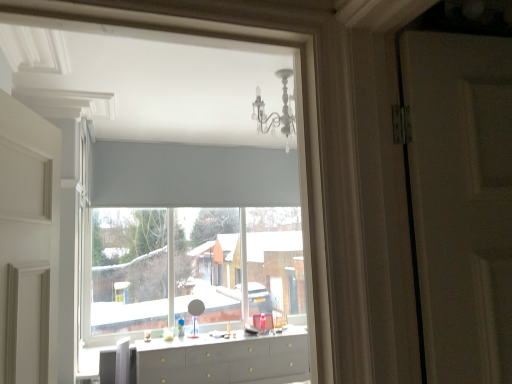
Image resolution: width=512 pixels, height=384 pixels. Describe the element at coordinates (225, 360) in the screenshot. I see `matte gray dresser at center` at that location.

I want to click on white matte window at center, so click(x=162, y=247).

Measure the distance between point (152, 154) and camera.

The distance of point (152, 154) from camera is 4.39 meters.

This screenshot has height=384, width=512. Identify the location of matte gray dresser at center. (225, 360).

How many degrees apart are the facing directions of white glossy counter top at center and matte gray dresser at center?

white glossy counter top at center and matte gray dresser at center are facing 0.216 degrees away from each other.

Which of these two, white glossy counter top at center or matte gray dresser at center, is thinner?

With smaller width is white glossy counter top at center.

Between point (165, 342) and point (170, 342), which one is positioned in front?

Point (165, 342)

Is white glossy counter top at center not close to matte gray dresser at center?

white glossy counter top at center is near matte gray dresser at center, not far away.

Who is bigger, matte gray dresser at center or white plastic swivel chair at lower left?

With larger size is matte gray dresser at center.

How distant is matte gray dresser at center from white plastic swivel chair at lower left?

matte gray dresser at center and white plastic swivel chair at lower left are 25.60 inches apart.

How many degrees apart are the facing directions of matte gray dresser at center and white plastic swivel chair at lower left?

There is a 0.742-degree angle between the facing directions of matte gray dresser at center and white plastic swivel chair at lower left.

Which object is positioned more to the right, matte gray dresser at center or white plastic swivel chair at lower left?

matte gray dresser at center is more to the right.

Is white plastic swivel chair at lower left far from matte gray dresser at center?

They are positioned close to each other.

Between white plastic swivel chair at lower left and matte gray dresser at center, which one appears on the left side from the viewer's perspective?

From the viewer's perspective, white plastic swivel chair at lower left appears more on the left side.

Can you tell me how much white plastic swivel chair at lower left and matte gray dresser at center differ in facing direction?

The facing directions of white plastic swivel chair at lower left and matte gray dresser at center are 0.742 degrees apart.

Where is `chest of drawers on the right of white plastic swivel chair at lower left`? chest of drawers on the right of white plastic swivel chair at lower left is located at coordinates (225, 360).

Which of these two, white plastic swivel chair at lower left or white matte window at center, is smaller?

white plastic swivel chair at lower left.

Which object is more forward, white plastic swivel chair at lower left or white matte window at center?

white plastic swivel chair at lower left.

Is white plastic swivel chair at lower left taller or shorter than white matte window at center?

In the image, white plastic swivel chair at lower left appears to be shorter than white matte window at center.

Does point (119, 366) appear closer or farther from the camera than point (197, 281)?

Clearly, point (119, 366) is closer to the camera than point (197, 281).

Can you tell me how much white plastic swivel chair at lower left and white glossy counter top at center differ in facing direction?

0.958 degrees.

Can you confirm if white plastic swivel chair at lower left is positioned to the left of white glossy counter top at center?

Correct, you'll find white plastic swivel chair at lower left to the left of white glossy counter top at center.

Is point (109, 357) more distant than point (257, 338)?

No, it is in front of (257, 338).

From the image's perspective, between white plastic swivel chair at lower left and white glossy counter top at center, which one is located above?

white glossy counter top at center appears higher in the image.

From the image's perspective, does white matte window at center appear lower than matte gray dresser at center?

No, from the image's perspective, white matte window at center is not below matte gray dresser at center.

Is white matte window at center to the left of matte gray dresser at center from the viewer's perspective?

Yes.

Consider the image. Is white matte window at center not inside matte gray dresser at center?

Yes, white matte window at center is outside of matte gray dresser at center.

From a real-world perspective, which object stands above the other?

white matte window at center, from a real-world perspective.

Does white matte window at center have a lesser width compared to white plastic swivel chair at lower left?

Indeed, white matte window at center has a lesser width compared to white plastic swivel chair at lower left.

Is white matte window at center further to the viewer compared to white plastic swivel chair at lower left?

Yes, white matte window at center is further from the viewer.

Considering the points (201, 326) and (119, 353), which point is in front, point (201, 326) or point (119, 353)?

The point (119, 353) is closer to the camera.

How much distance is there between white matte window at center and white plastic swivel chair at lower left?

white matte window at center and white plastic swivel chair at lower left are 2.29 meters apart.

You are a GUI agent. You are given a task and a screenshot of the screen. Output one action in this format:
    pyautogui.click(x=<x>, y=<y>)
    Task: Click on the chest of drawers in front of the white glossy counter top at center
    The image size is (512, 384).
    Given the screenshot: What is the action you would take?
    pyautogui.click(x=225, y=360)

Identify the location of swivel chair lying on the left of matte gray dresser at center. The image size is (512, 384). (118, 364).

From the image, which object appears to be farther from white glossy counter top at center, matte gray dresser at center or white plastic swivel chair at lower left?

white plastic swivel chair at lower left.

Based on their spatial positions, is matte gray dresser at center or white matte window at center closer to white plastic swivel chair at lower left?

A: matte gray dresser at center is positioned closer to the anchor white plastic swivel chair at lower left.

From the image, which object appears to be farther from white plastic swivel chair at lower left, white matte window at center or white glossy counter top at center?

white matte window at center lies further to white plastic swivel chair at lower left than the other object.

Based on their spatial positions, is white plastic swivel chair at lower left or white matte window at center closer to matte gray dresser at center?

white plastic swivel chair at lower left is closer to matte gray dresser at center.

Which object lies nearer to the anchor point white glossy counter top at center, white plastic swivel chair at lower left or white matte window at center?

white plastic swivel chair at lower left is positioned closer to the anchor white glossy counter top at center.

Estimate the real-world distances between objects in this image. Which object is further from white matte window at center, matte gray dresser at center or white plastic swivel chair at lower left?

white plastic swivel chair at lower left lies further to white matte window at center than the other object.

Estimate the real-world distances between objects in this image. Which object is further from white matte window at center, white plastic swivel chair at lower left or matte gray dresser at center?

white plastic swivel chair at lower left lies further to white matte window at center than the other object.

Considering their positions, is white glossy counter top at center positioned closer to white matte window at center than white plastic swivel chair at lower left?

white glossy counter top at center is closer to white matte window at center.

The width and height of the screenshot is (512, 384). In order to click on counter top between white matte window at center and white plastic swivel chair at lower left in the vertical direction in this screenshot , I will do tap(238, 343).

At what (x,y) coordinates should I click in order to perform the action: click on counter top that lies between white matte window at center and matte gray dresser at center from top to bottom. Please return your answer as a coordinate pair (x, y). This screenshot has width=512, height=384. Looking at the image, I should click on (238, 343).

The width and height of the screenshot is (512, 384). Find the location of `swivel chair between white matte window at center and matte gray dresser at center from top to bottom`. swivel chair between white matte window at center and matte gray dresser at center from top to bottom is located at coordinates (118, 364).

Find the location of a particular element. This screenshot has height=384, width=512. counter top located between white plastic swivel chair at lower left and matte gray dresser at center in the left-right direction is located at coordinates (238, 343).